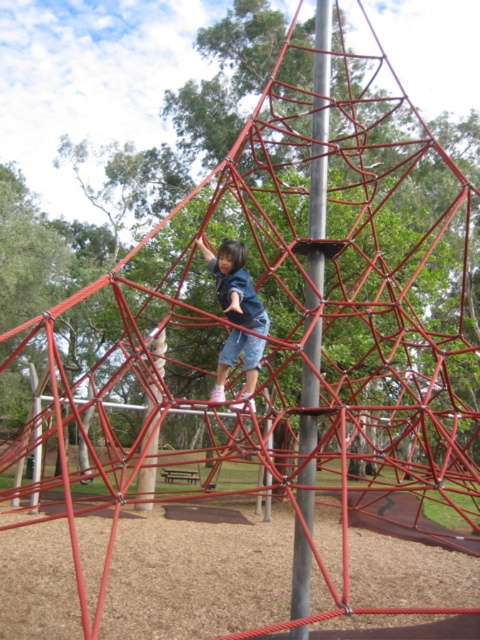
You are a maintenance worker checking the playground equipment. You need to attach a safety harness to the metallic pole at center and the matte blue shorts at center. Which object requires a larger diameter harness ring?

The metallic pole at center requires a larger diameter harness ring because it might be wider than the matte blue shorts at center.

You are a maintenance worker checking the playground structure. The safety regulations require that all metallic poles must be positioned within the central area defined by coordinates between 0.4 and 0.6 on both the x and y axes. Does the metallic pole at center meet this requirement?

The metallic pole at center is positioned at point (312, 312), which falls within the required central area between 0.4 and 0.6 on both axes. Therefore, it meets the safety regulations.

You are a parent watching your child play on the playground. You notice the metallic pole at center and the matte blue shorts at center. Which object is higher from the ground?

The metallic pole at center is above matte blue shorts at center, so the metallic pole at center is higher from the ground.